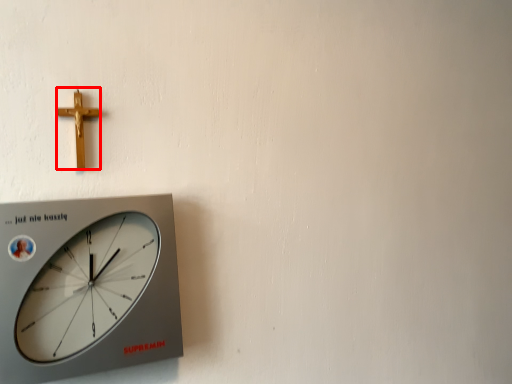
Question: Observing the image, what is the correct spatial positioning of crucifix (annotated by the red box) in reference to wall clock?

Choices:
 (A) left
 (B) right

Answer: (A)